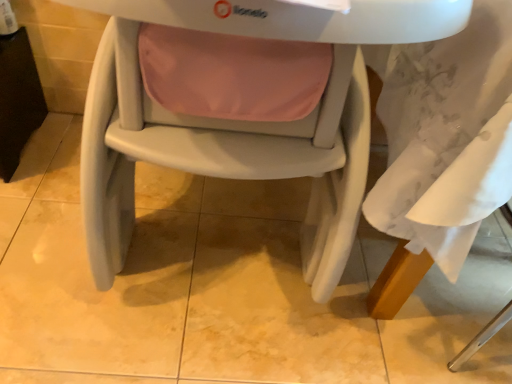
Question: Is matte plastic highchair at center looking in the opposite direction of black plastic table at left?

Choices:
 (A) no
 (B) yes

Answer: (A)

Question: Is matte plastic highchair at center not near black plastic table at left?

Choices:
 (A) yes
 (B) no

Answer: (B)

Question: Is matte plastic highchair at center facing towards black plastic table at left?

Choices:
 (A) yes
 (B) no

Answer: (B)

Question: Is black plastic table at left inside matte plastic highchair at center?

Choices:
 (A) no
 (B) yes

Answer: (A)

Question: Considering the relative positions of matte plastic highchair at center and black plastic table at left in the image provided, is matte plastic highchair at center behind black plastic table at left?

Choices:
 (A) yes
 (B) no

Answer: (B)

Question: Considering the relative sizes of matte plastic highchair at center and black plastic table at left in the image provided, is matte plastic highchair at center bigger than black plastic table at left?

Choices:
 (A) no
 (B) yes

Answer: (B)

Question: From a real-world perspective, is black plastic table at left located higher than matte plastic highchair at center?

Choices:
 (A) yes
 (B) no

Answer: (B)

Question: From a real-world perspective, is black plastic table at left physically below matte plastic highchair at center?

Choices:
 (A) no
 (B) yes

Answer: (B)

Question: Is black plastic table at left far away from matte plastic highchair at center?

Choices:
 (A) yes
 (B) no

Answer: (B)

Question: Can you confirm if black plastic table at left is wider than matte plastic highchair at center?

Choices:
 (A) yes
 (B) no

Answer: (B)

Question: From the image's perspective, is black plastic table at left under matte plastic highchair at center?

Choices:
 (A) yes
 (B) no

Answer: (B)

Question: Can you confirm if black plastic table at left is positioned to the left of matte plastic highchair at center?

Choices:
 (A) no
 (B) yes

Answer: (B)

Question: Considering their positions, is matte plastic highchair at center located in front of or behind black plastic table at left?

Choices:
 (A) behind
 (B) front

Answer: (B)